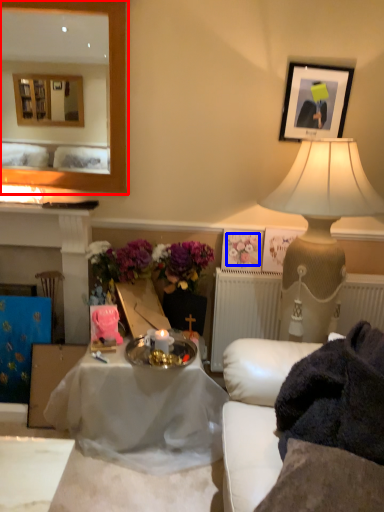
Question: Which object is further to the camera taking this photo, mirror (highlighted by a red box) or flower (highlighted by a blue box)?

Choices:
 (A) mirror
 (B) flower

Answer: (B)